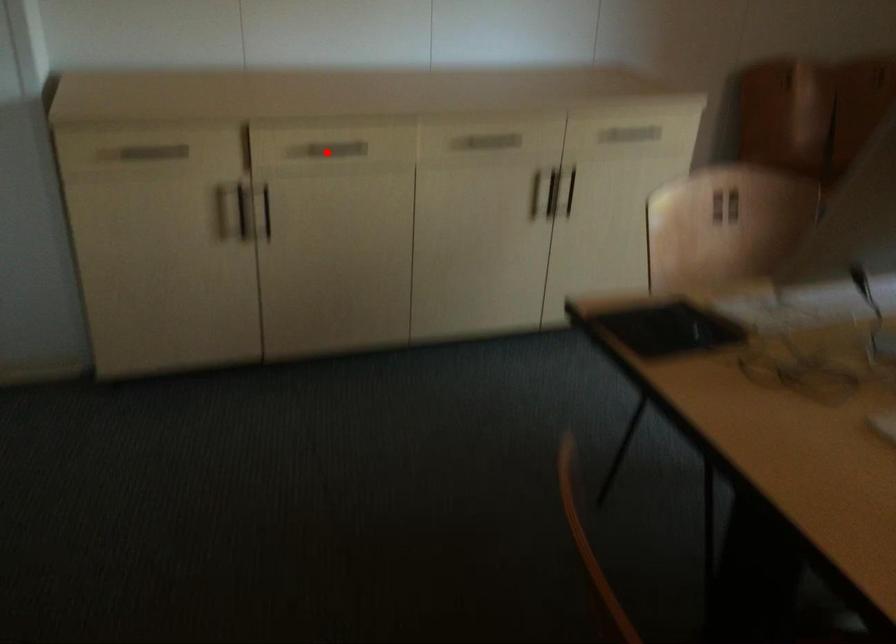
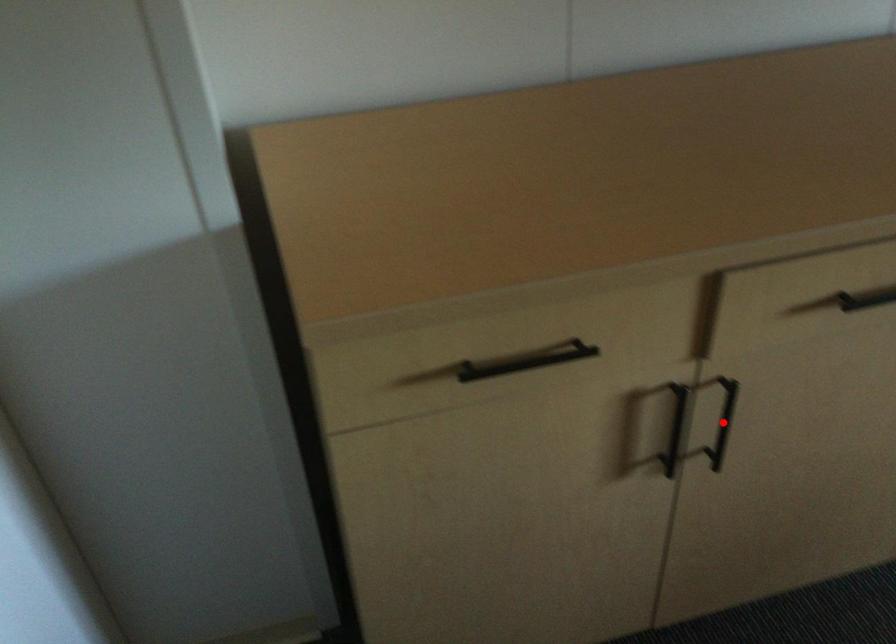
I am providing you with two images of the same scene from different viewpoints. A red point is marked on the first image and another point is marked on the second image. Do the highlighted points in image1 and image2 indicate the same real-world spot?

No